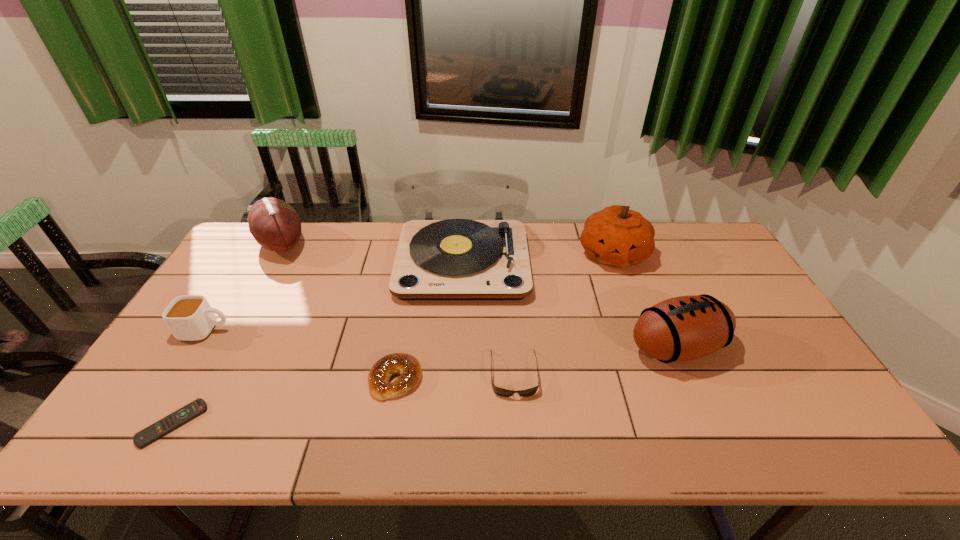
Image resolution: width=960 pixels, height=540 pixels. I want to click on the tallest object, so click(455, 259).

The image size is (960, 540). What are the coordinates of `pumpkin` in the screenshot? It's located at (616, 236).

The height and width of the screenshot is (540, 960). I want to click on the farther football (American), so click(275, 225).

Where is `the nearer football (American)`? This screenshot has width=960, height=540. the nearer football (American) is located at coordinates (684, 328).

Identify the location of cup. (189, 317).

Identify the location of bagel. (409, 368).

I want to click on sunglasses, so click(499, 391).

You are a GUI agent. You are given a task and a screenshot of the screen. Output one action in this format:
    pyautogui.click(x=<x>, y=<y>)
    Task: Click on the shortest object
    The width and height of the screenshot is (960, 540).
    Given the screenshot: What is the action you would take?
    (x=150, y=434)

This screenshot has width=960, height=540. Find the location of `vacant space located with the tonearm facing the front of the record player`. vacant space located with the tonearm facing the front of the record player is located at coordinates (458, 375).

Where is `free space located 0.090m on the front-facing side of the pumpkin`? free space located 0.090m on the front-facing side of the pumpkin is located at coordinates (629, 296).